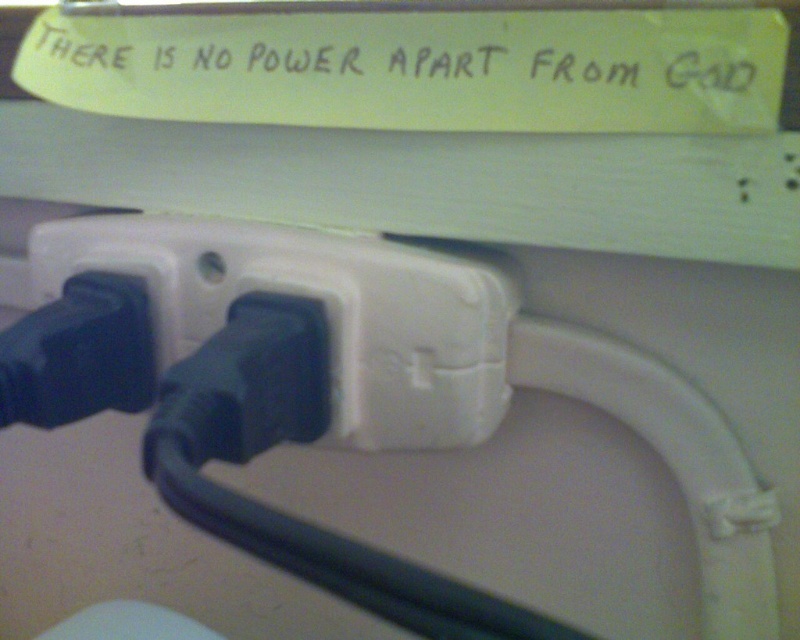
Is white plastic power outlet at center to the right of yellow paper at upper center from the viewer's perspective?

In fact, white plastic power outlet at center is to the left of yellow paper at upper center.

Who is shorter, white plastic power outlet at center or yellow paper at upper center?

yellow paper at upper center

This screenshot has width=800, height=640. Find the location of `white plastic power outlet at center`. white plastic power outlet at center is located at coordinates (324, 310).